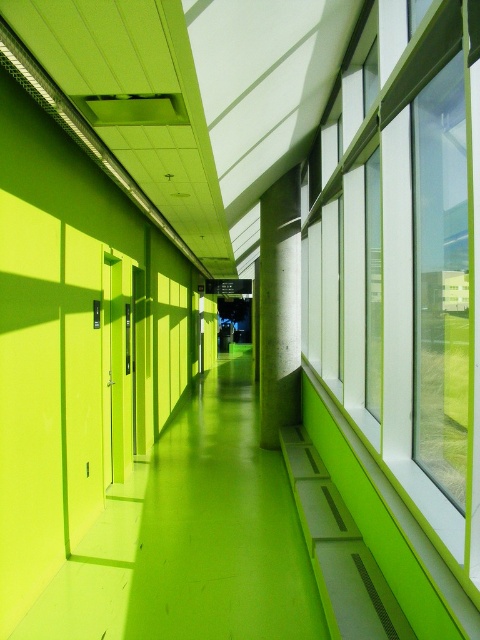
You are standing at the entrance of the corridor and see two points marked in the image. The first point is at coordinate point(372,188) and the second is at point(273,369). If you want to reach the point that is closer to you, which coordinate should you head towards?

Point(372,188) is in front of point(273,369), so you should head towards point(372,188) since it is closer to your current position at the entrance.

You are a delivery person carrying a large box that is 2 meters wide. You need to navigate through the corridor shown in the image. Which object, the transparent glass windows at right or the green concrete pillar at center, will you have to maneuver around due to their size?

The transparent glass windows at right is larger in size than the green concrete pillar at center, so you will need to maneuver around the transparent glass windows at right since they are wider and may obstruct the path for the large box.